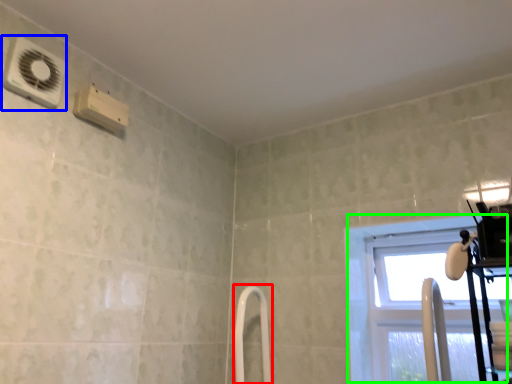
Question: Considering the real-world distances, which object is farthest from shower door (highlighted by a red box)? air conditioning (highlighted by a blue box) or window (highlighted by a green box)?

Choices:
 (A) air conditioning
 (B) window

Answer: (A)